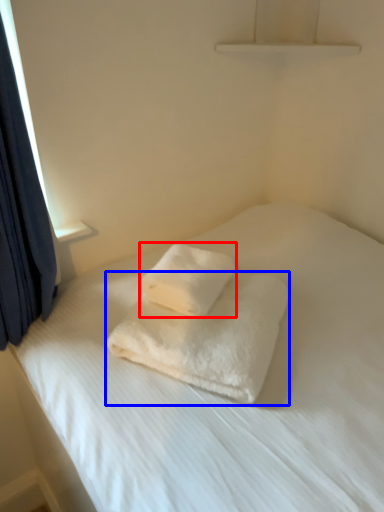
Question: Which object appears closest to the camera in this image, towel (highlighted by a red box) or towel (highlighted by a blue box)?

Choices:
 (A) towel
 (B) towel

Answer: (B)